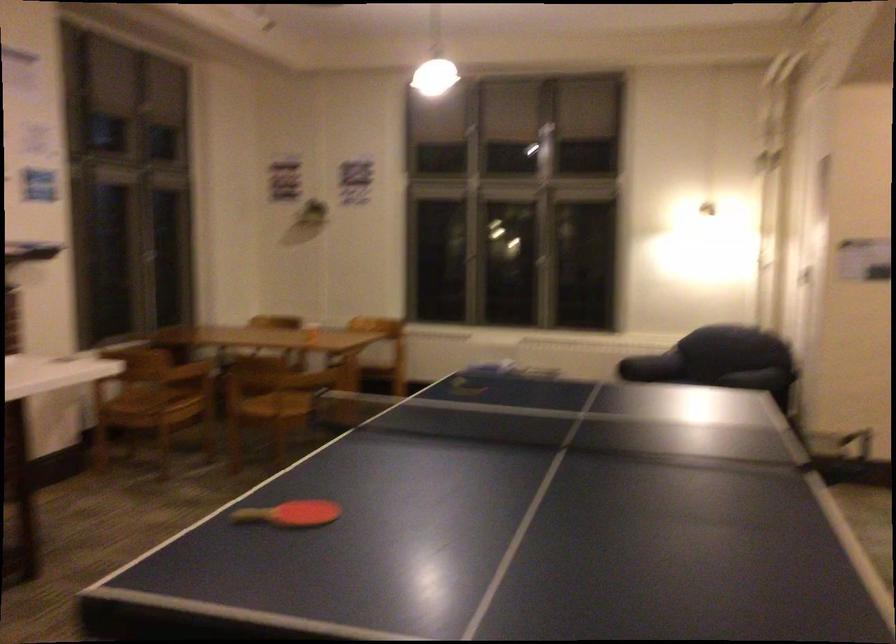
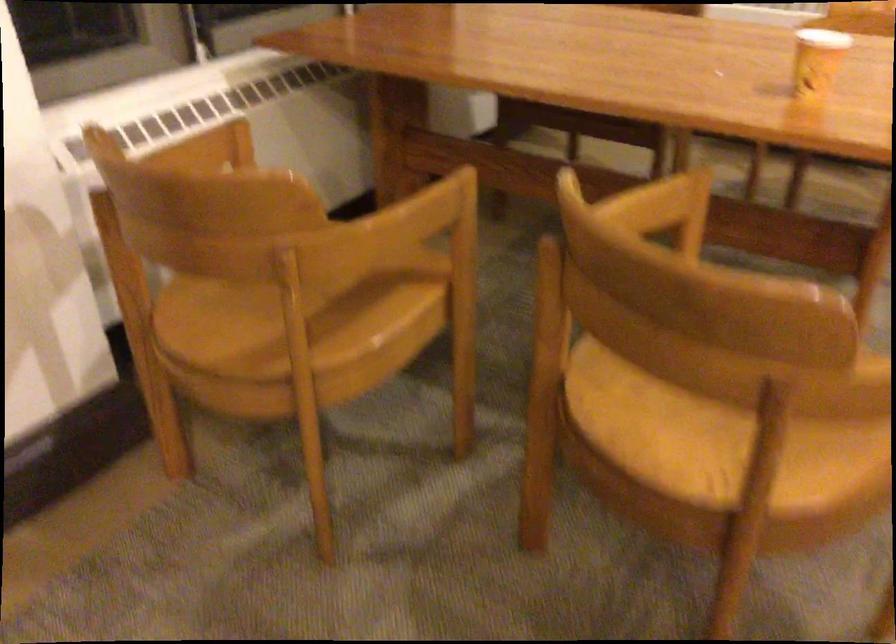
Locate, in the second image, the point that corresponds to pixel 271 411 in the first image.

(704, 433)